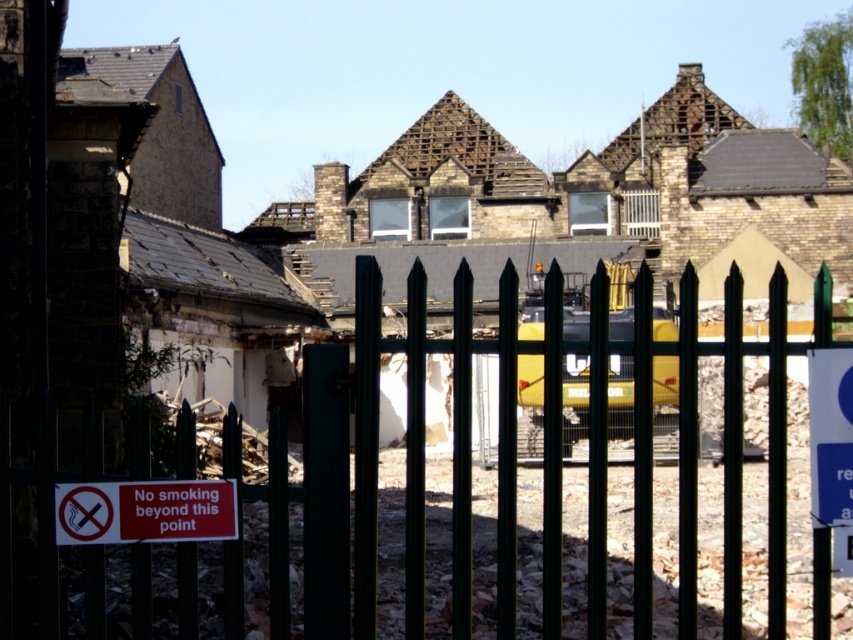
You are a safety inspector on the construction site. You see the green metal fence at center and the white plastic sign at right. Which object is closer to you?

The green metal fence at center is closer to you because it is in front of the white plastic sign at right.

You are a safety inspector standing at the entrance of the construction site. You need to check if the green metal fence at center is tall enough to block the view of the white plastic sign at right from outside the site. Can you confirm this?

The green metal fence at center is much taller than the white plastic sign at right, so it can block the view of the white plastic sign at right from outside the site.

You are a safety inspector checking the construction site. You notice the green metal fence at center and the red plastic sign at lower left. Which object is taller?

The green metal fence at center is taller than the red plastic sign at lower left according to the description.